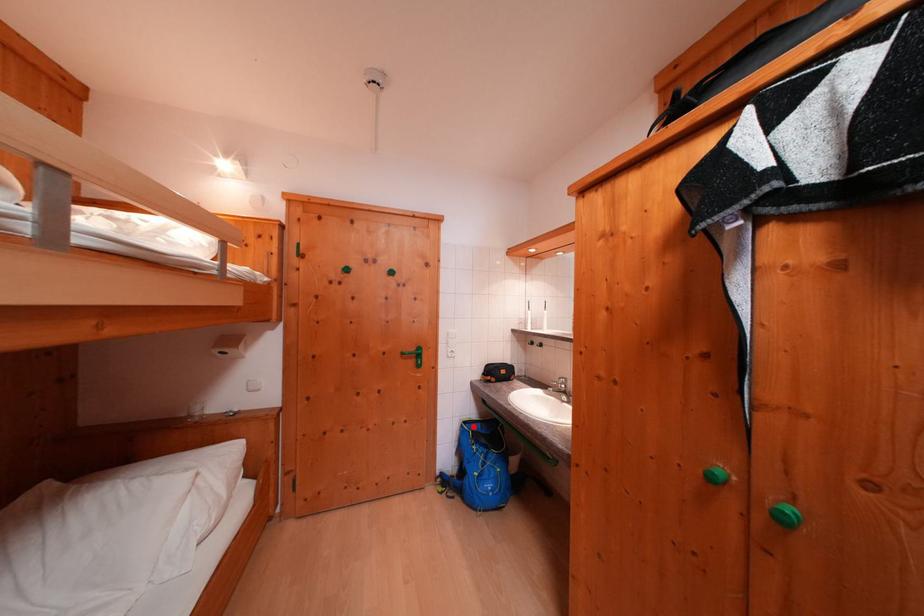
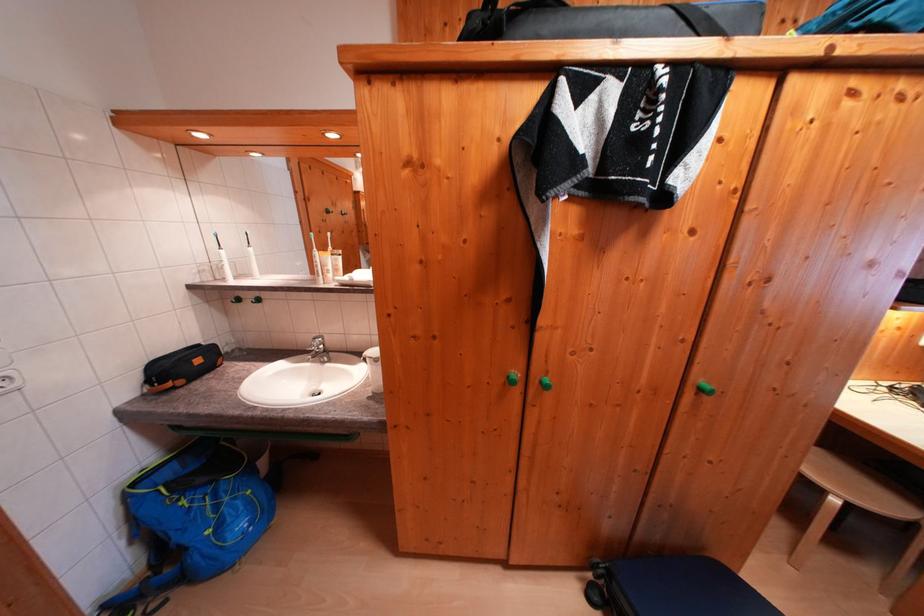
Question: I am providing you with two images of the same scene from different viewpoints. Image1 has a red point marked. In image2, the corresponding 3D location appears at what relative position? Reply with the corresponding letter.

Choices:
 (A) Closer
 (B) Farther

Answer: (A)